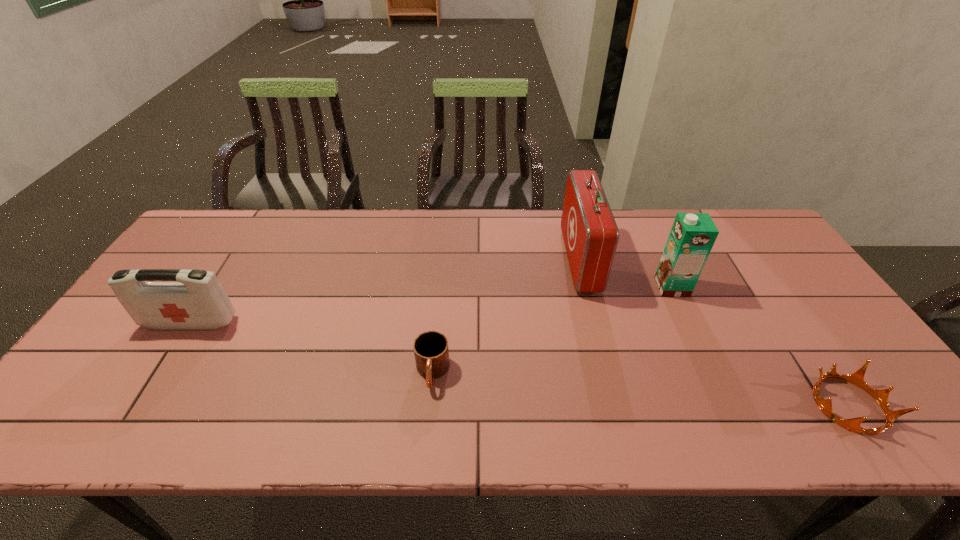
Identify the location of free spot located on the left of the carton. The width and height of the screenshot is (960, 540). (599, 287).

Find the location of a particular element. Image resolution: width=960 pixels, height=540 pixels. vacant region located 0.280m on the front side of the third nearest object is located at coordinates (122, 431).

The width and height of the screenshot is (960, 540). Find the location of `blank space located on the side of the mug with the handle`. blank space located on the side of the mug with the handle is located at coordinates (426, 441).

Find the location of a particular element. Image resolution: width=960 pixels, height=540 pixels. vacant area located on the left of the rightmost object is located at coordinates (779, 405).

The image size is (960, 540). What are the coordinates of `object that is at the far edge` in the screenshot? It's located at (590, 233).

Image resolution: width=960 pixels, height=540 pixels. Find the location of `object positioned at the near edge`. object positioned at the near edge is located at coordinates (857, 378).

You are a GUI agent. You are given a task and a screenshot of the screen. Output one action in this format:
    pyautogui.click(x=<x>, y=<y>)
    Task: Click on the object positioned at the left edge
    The height and width of the screenshot is (540, 960).
    Given the screenshot: What is the action you would take?
    pyautogui.click(x=198, y=301)

Locate an element on the screen. The height and width of the screenshot is (540, 960). object that is at the right edge is located at coordinates (857, 378).

Find the location of a particular element. This screenshot has height=540, width=960. object that is at the near right corner is located at coordinates (857, 378).

In the image, there is a desktop. Find the location of `vacant region at the far edge`. vacant region at the far edge is located at coordinates (440, 226).